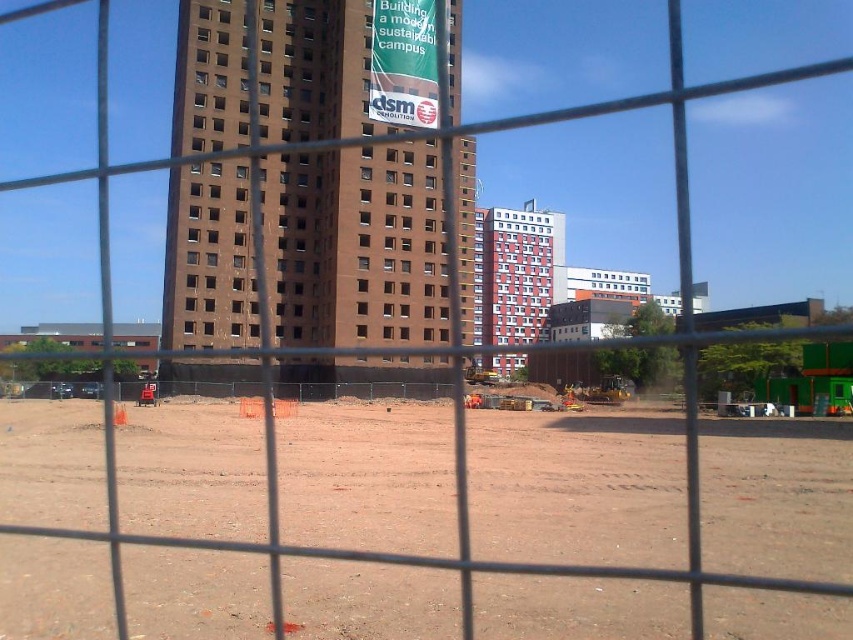
Based on the photo, measure the distance between point (235,504) and camera.

Point (235,504) and camera are 8.13 meters apart.

Does brown dirt field at center appear over brown brick building at center?

Actually, brown dirt field at center is below brown brick building at center.

Which is behind, point (573, 449) or point (456, 90)?

Positioned behind is point (456, 90).

I want to click on brown dirt field at center, so click(x=577, y=488).